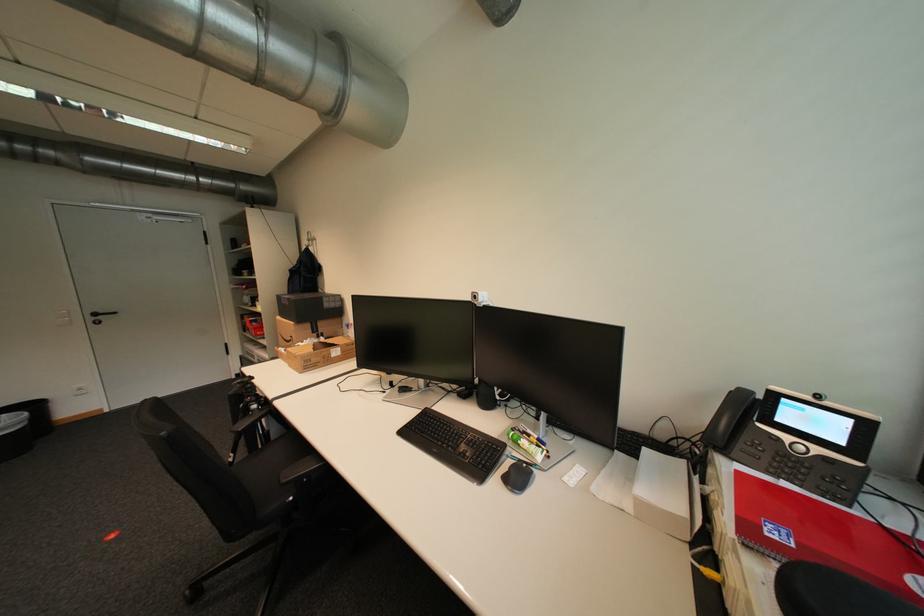
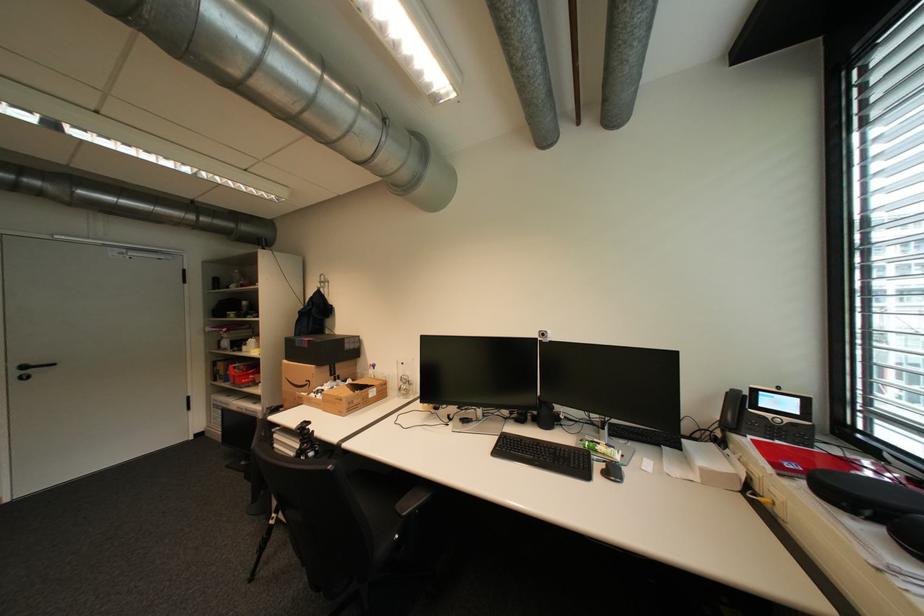
Find the pixel in the second image that matches point (103, 315) in the first image.

(32, 368)